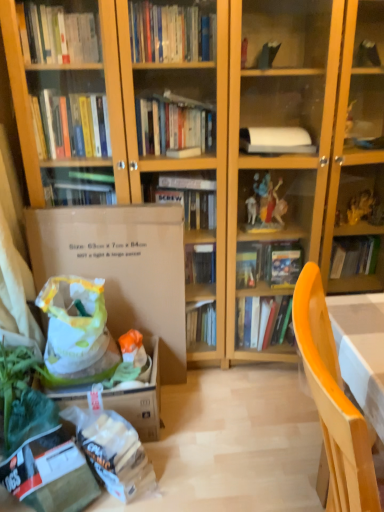
Question: Can you confirm if white plastic grocery bag at lower left is thinner than wooden chair at lower right?

Choices:
 (A) no
 (B) yes

Answer: (A)

Question: Does white plastic grocery bag at lower left have a greater height compared to wooden chair at lower right?

Choices:
 (A) no
 (B) yes

Answer: (A)

Question: Could you tell me if white plastic grocery bag at lower left is turned towards wooden chair at lower right?

Choices:
 (A) yes
 (B) no

Answer: (A)

Question: Is the position of white plastic grocery bag at lower left less distant than that of wooden chair at lower right?

Choices:
 (A) yes
 (B) no

Answer: (B)

Question: Does white plastic grocery bag at lower left appear on the right side of wooden chair at lower right?

Choices:
 (A) no
 (B) yes

Answer: (A)

Question: From a real-world perspective, does white plastic grocery bag at lower left stand above wooden chair at lower right?

Choices:
 (A) no
 (B) yes

Answer: (A)

Question: Considering the relative sizes of brown cardboard box at left and wooden chair at lower right in the image provided, is brown cardboard box at left taller than wooden chair at lower right?

Choices:
 (A) no
 (B) yes

Answer: (B)

Question: Is brown cardboard box at left not within wooden chair at lower right?

Choices:
 (A) yes
 (B) no

Answer: (A)

Question: From a real-world perspective, is brown cardboard box at left below wooden chair at lower right?

Choices:
 (A) no
 (B) yes

Answer: (B)

Question: From the image's perspective, does brown cardboard box at left appear lower than wooden chair at lower right?

Choices:
 (A) no
 (B) yes

Answer: (A)

Question: Are brown cardboard box at left and wooden chair at lower right far apart?

Choices:
 (A) yes
 (B) no

Answer: (A)

Question: Could you tell me if brown cardboard box at left is turned towards wooden chair at lower right?

Choices:
 (A) yes
 (B) no

Answer: (A)

Question: Are wooden chair at lower right and white plastic grocery bag at lower left far apart?

Choices:
 (A) yes
 (B) no

Answer: (A)